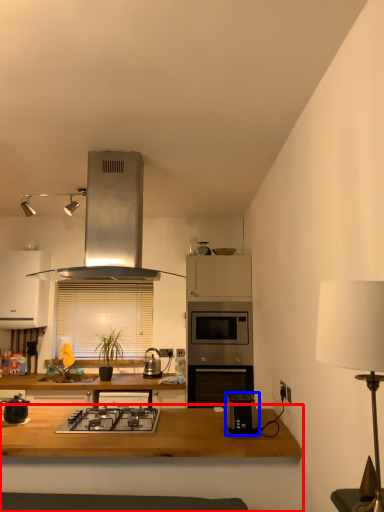
Question: Which object appears farthest to the camera in this image, table (highlighted by a red box) or toaster (highlighted by a blue box)?

Choices:
 (A) table
 (B) toaster

Answer: (B)